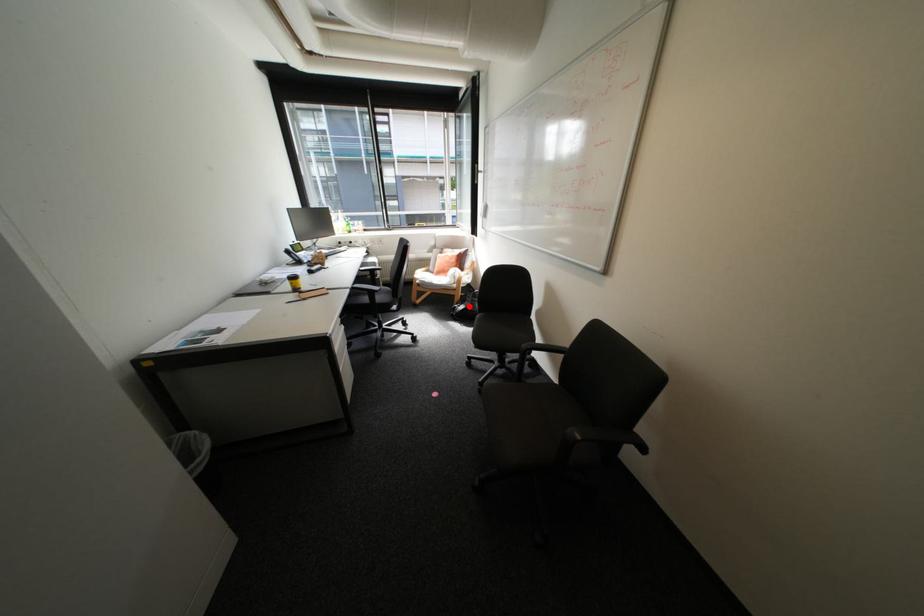
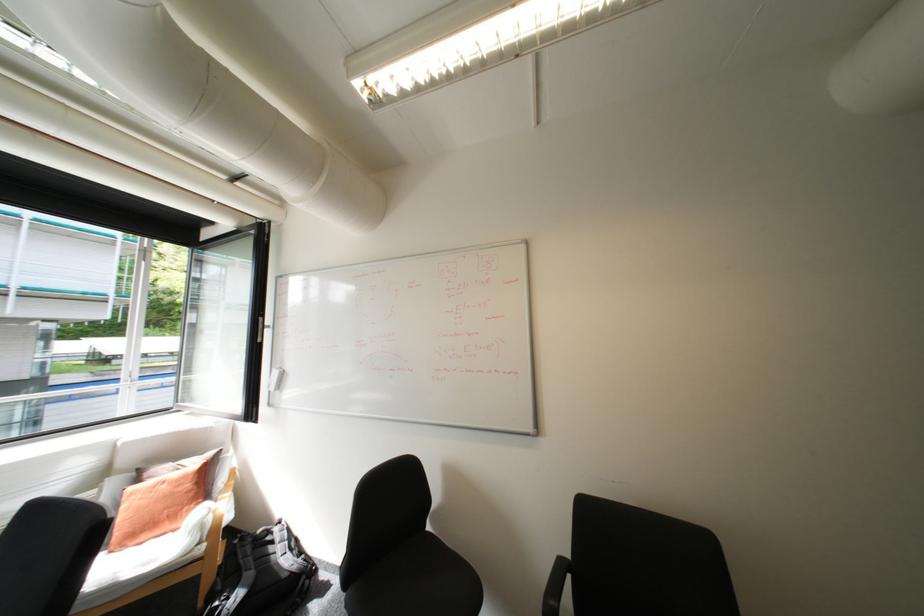
Locate, in the second image, the point that corresponds to the highlighted location in the first image.

(238, 599)